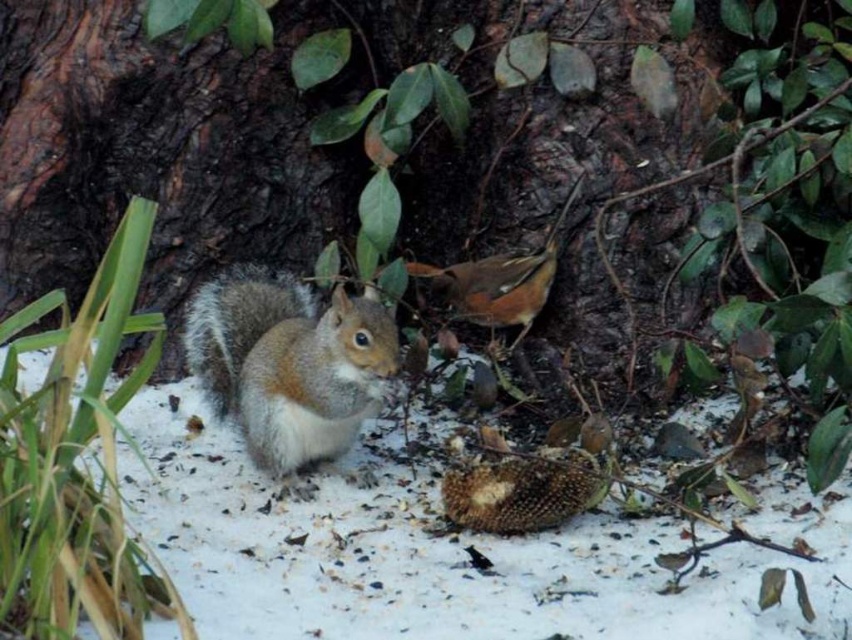
Question: Is white fluffy snow at center to the left of gray-furred squirrel at center from the viewer's perspective?

Choices:
 (A) no
 (B) yes

Answer: (A)

Question: Which point is closer to the camera?

Choices:
 (A) (488, 273)
 (B) (308, 308)

Answer: (B)

Question: Among these points, which one is farthest from the camera?

Choices:
 (A) (639, 528)
 (B) (199, 323)
 (C) (492, 324)

Answer: (C)

Question: Considering the relative positions of gray-furred squirrel at center and brown speckled bird at center in the image provided, where is gray-furred squirrel at center located with respect to brown speckled bird at center?

Choices:
 (A) below
 (B) above

Answer: (A)

Question: Is white fluffy snow at center bigger than brown speckled bird at center?

Choices:
 (A) yes
 (B) no

Answer: (A)

Question: Which object appears farthest from the camera in this image?

Choices:
 (A) gray-furred squirrel at center
 (B) white fluffy snow at center
 (C) brown speckled bird at center

Answer: (C)